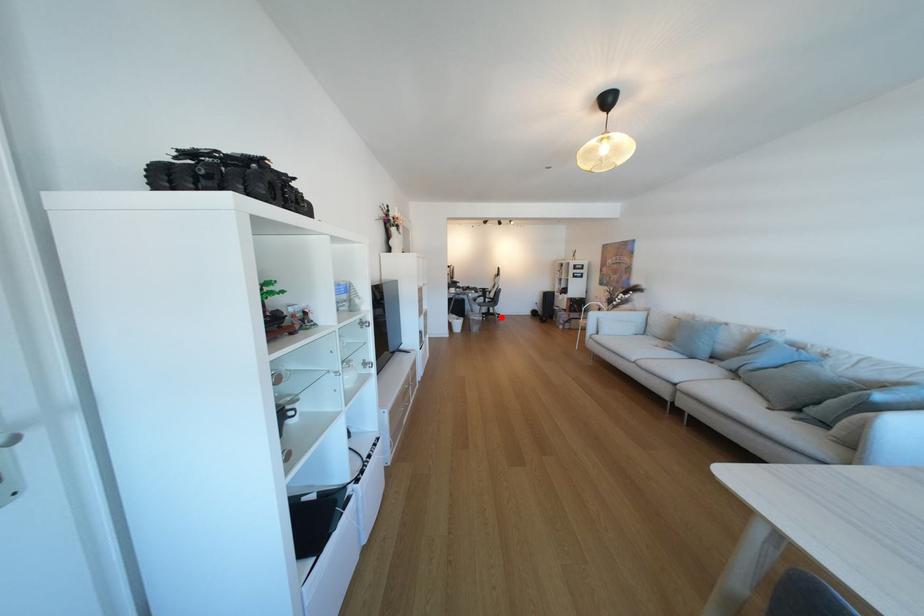
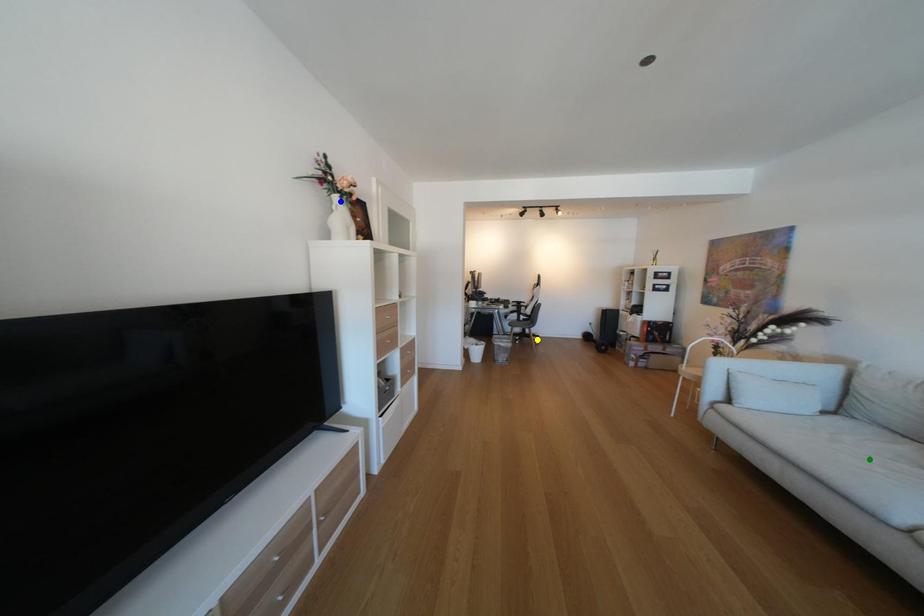
Question: I am providing you with two images of the same scene from different viewpoints. A red point is marked on the first image. You are given multiple points on the second image. Which point in image 2 is actually the same real-world point as the red point in image 1?

Choices:
 (A) green point
 (B) blue point
 (C) yellow point

Answer: (C)